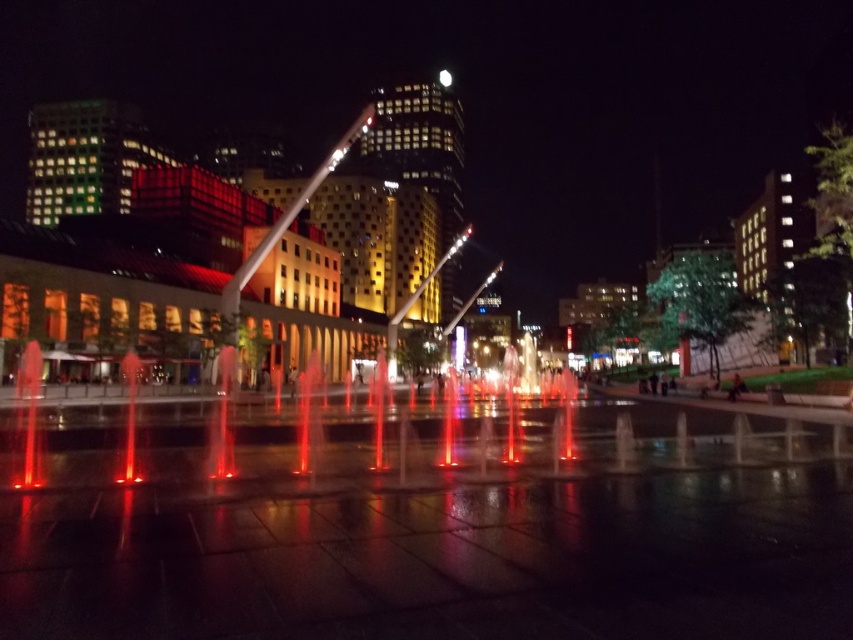
Consider the image. You are a photographer standing at the edge of the plaza. You want to capture the translucent glass water jets at center in your shot. Since you can only focus on objects within 1 meter of the point marked by point (x=387, y=435), will the translucent glass water jets at center be in focus?

The translucent glass water jets at center is represented by point (x=387, y=435), so yes, the water jets will be in focus as they are exactly at the focus point.

You are standing in the plaza and want to take a photo of the translucent glass water jets at center. Where exactly should you point your camera?

You should point your camera at point (387, 435) to capture the translucent glass water jets at center.